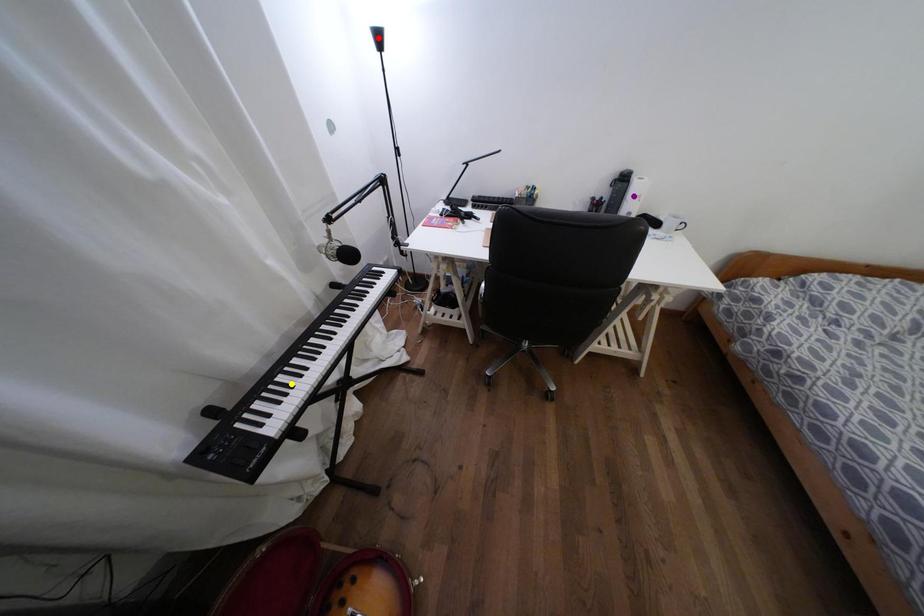
Order these from farthest to nearest:
- purple point
- red point
- yellow point

purple point
red point
yellow point